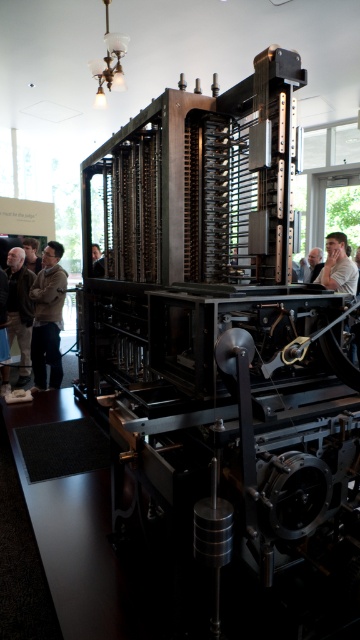
What do you see at coordinates (47, 317) in the screenshot?
I see `dark brown leather jacket at lower left` at bounding box center [47, 317].

Find the location of a particular element. This screenshot has height=640, width=360. dark brown leather jacket at lower left is located at coordinates (47, 317).

Is dark brown leather jacket at lower left closer to camera compared to brown leather jacket at left?

Yes.

Does dark brown leather jacket at lower left have a greater width compared to brown leather jacket at left?

No, dark brown leather jacket at lower left is not wider than brown leather jacket at left.

This screenshot has height=640, width=360. What are the coordinates of `dark brown leather jacket at lower left` in the screenshot? It's located at pyautogui.click(x=47, y=317).

This screenshot has height=640, width=360. I want to click on dark brown leather jacket at lower left, so click(x=47, y=317).

Which of these two, brown leather jacket at left or light brown hair at right, stands shorter?

light brown hair at right is shorter.

Which is in front, point (24, 275) or point (330, 284)?

Point (330, 284) is in front.

Find the location of a particular element. The image size is (360, 640). brown leather jacket at left is located at coordinates (20, 308).